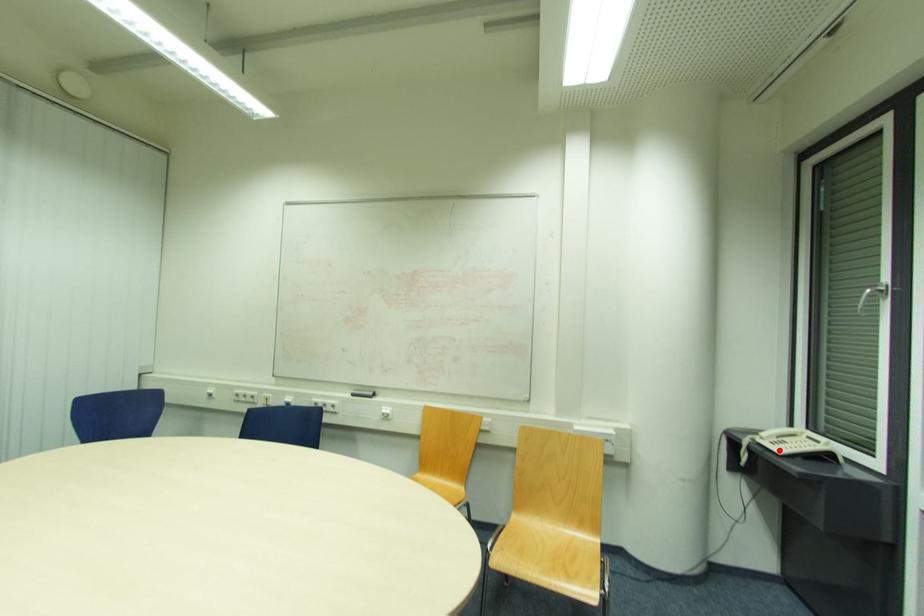
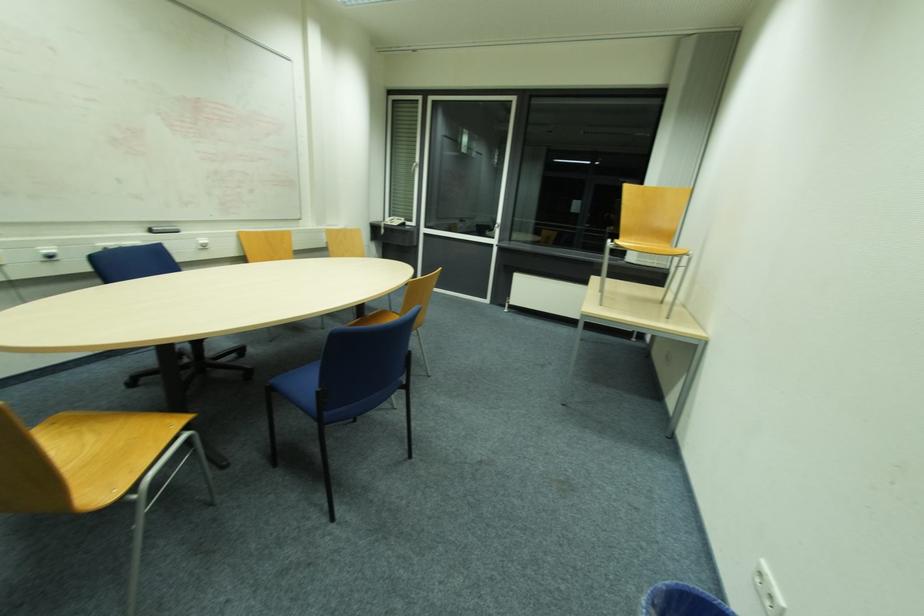
Locate, in the second image, the point that corresponds to the highlighted location in the first image.

(397, 225)